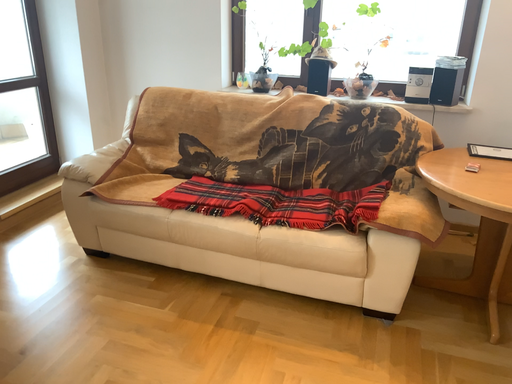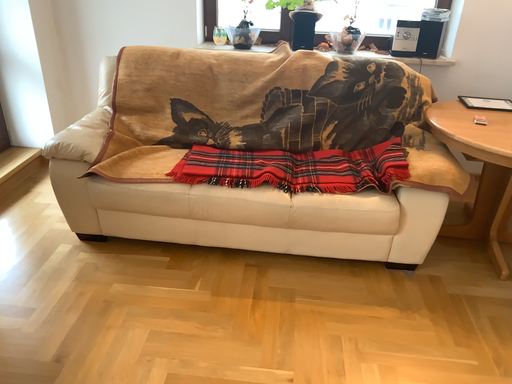
Question: How did the camera likely rotate when shooting the video?

Choices:
 (A) rotated right
 (B) rotated left

Answer: (A)